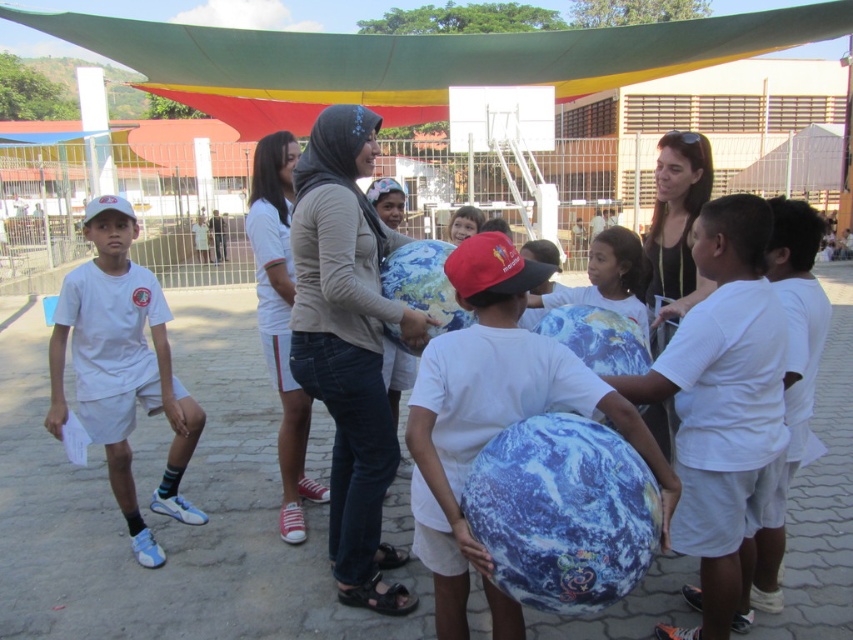
Question: Does matte blue globe at center have a larger size compared to blue fabric beach ball at center?

Choices:
 (A) yes
 (B) no

Answer: (A)

Question: Which of these objects is positioned farthest from the matte gray hoodie at center?

Choices:
 (A) blue fabric beach ball at center
 (B) white matte uniform at left
 (C) denim jeans at center
 (D) matte blue globe at center

Answer: (A)

Question: Is earth-patterned fabric globe at center below blue fabric globe at center?

Choices:
 (A) no
 (B) yes

Answer: (A)

Question: Estimate the real-world distances between objects in this image. Which object is closer to the white matte uniform at left?

Choices:
 (A) earth-patterned fabric globe at center
 (B) blue fabric globe at center
 (C) smooth black shirt at center

Answer: (A)

Question: Among these objects, which one is farthest from the camera?

Choices:
 (A) blue fabric globe at center
 (B) blue fabric beach ball at center
 (C) denim jeans at center

Answer: (C)

Question: Considering the relative positions of blue fabric beach ball at center and smooth black shirt at center in the image provided, where is blue fabric beach ball at center located with respect to smooth black shirt at center?

Choices:
 (A) below
 (B) above

Answer: (A)